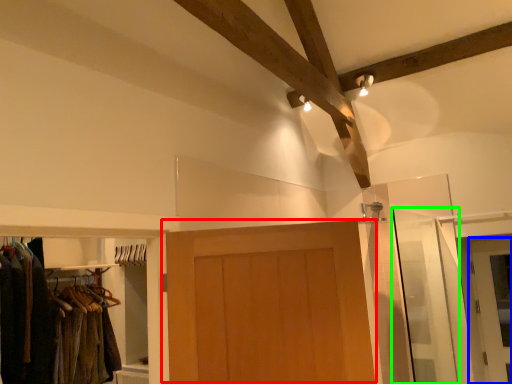
Question: Considering the real-world distances, which object is closest to door (highlighted by a red box)? door (highlighted by a blue box) or screen door (highlighted by a green box).

Choices:
 (A) door
 (B) screen door

Answer: (B)